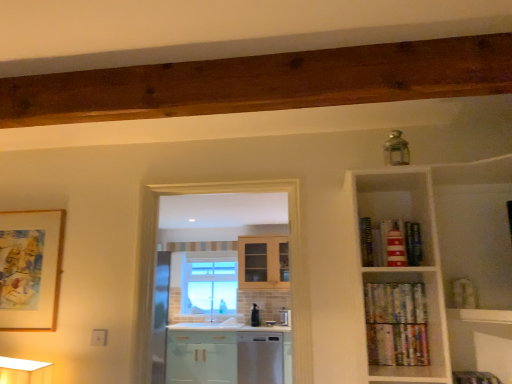
You are a GUI agent. You are given a task and a screenshot of the screen. Output one action in this format:
    pyautogui.click(x=<x>, y=<y>)
    Task: Click on the clear glass window at center
    The height and width of the screenshot is (384, 512).
    Given the screenshot: What is the action you would take?
    pyautogui.click(x=209, y=283)

The height and width of the screenshot is (384, 512). What do you see at coordinates (395, 303) in the screenshot?
I see `hardcover books at right, the second book positioned from the top` at bounding box center [395, 303].

What do you see at coordinates (30, 269) in the screenshot?
I see `wooden picture frame at left` at bounding box center [30, 269].

Where is `multicolored paperbacks at lower right, marked as the 3th book in a top-to-bottom arrangement`? The height and width of the screenshot is (384, 512). multicolored paperbacks at lower right, marked as the 3th book in a top-to-bottom arrangement is located at coordinates (397, 344).

What do you see at coordinates (397, 344) in the screenshot? The width and height of the screenshot is (512, 384). I see `multicolored paperbacks at lower right, marked as the 3th book in a top-to-bottom arrangement` at bounding box center [397, 344].

What are the coordinates of `metallic stainless steel kettle at center` in the screenshot? It's located at (255, 315).

Considering the relative sizes of multicolored paperbacks at lower right, marked as the 3th book in a top-to-bottom arrangement, and hardcover books at right, the second book positioned from the top, in the image provided, is multicolored paperbacks at lower right, marked as the 3th book in a top-to-bottom arrangement, shorter than hardcover books at right, the second book positioned from the top,?

No.

Does multicolored paperbacks at lower right, marked as the 3th book in a top-to-bottom arrangement, appear on the left side of hardcover books at right, the second book positioned from the top?

In fact, multicolored paperbacks at lower right, marked as the 3th book in a top-to-bottom arrangement, is to the right of hardcover books at right, the second book positioned from the top.

From the picture: Does multicolored paperbacks at lower right, the first book from the bottom, have a greater width compared to hardcover books at right, positioned as the 2th book in bottom-to-top order?

Incorrect, the width of multicolored paperbacks at lower right, the first book from the bottom, does not surpass that of hardcover books at right, positioned as the 2th book in bottom-to-top order.

Can you confirm if multicolored paperbacks at lower right, marked as the 3th book in a top-to-bottom arrangement, is smaller than hardcover books at right, positioned as the 2th book in bottom-to-top order?

Indeed, multicolored paperbacks at lower right, marked as the 3th book in a top-to-bottom arrangement, has a smaller size compared to hardcover books at right, positioned as the 2th book in bottom-to-top order.

Which object is wider, wooden picture frame at left or satin white dishwasher at center?

satin white dishwasher at center is wider.

Which is in front, point (33, 245) or point (246, 381)?

The point (33, 245) is more forward.

Is wooden picture frame at left positioned far away from satin white dishwasher at center?

That's right, there is a large distance between wooden picture frame at left and satin white dishwasher at center.

In the scene shown: Can you confirm if wooden picture frame at left is smaller than satin white dishwasher at center?

Yes.

Is point (368, 350) positioned in front of point (252, 316)?

Yes, it is.

Is multicolored paperbacks at lower right, the first book from the bottom, positioned far away from metallic stainless steel kettle at center?

Absolutely, multicolored paperbacks at lower right, the first book from the bottom, is distant from metallic stainless steel kettle at center.

Looking at this image, considering the sizes of objects multicolored paperbacks at lower right, the first book from the bottom, and metallic stainless steel kettle at center in the image provided, who is shorter, multicolored paperbacks at lower right, the first book from the bottom, or metallic stainless steel kettle at center?

multicolored paperbacks at lower right, the first book from the bottom.

Considering the relative positions of multicolored paperbacks at lower right, marked as the 3th book in a top-to-bottom arrangement, and metallic stainless steel kettle at center in the image provided, is multicolored paperbacks at lower right, marked as the 3th book in a top-to-bottom arrangement, in front of metallic stainless steel kettle at center?

That is True.

Looking at the image, does metallic stainless steel kettle at center seem bigger or smaller compared to red striped lighthouse at upper right, placed as the 1th book when sorted from top to bottom?

metallic stainless steel kettle at center is smaller than red striped lighthouse at upper right, placed as the 1th book when sorted from top to bottom.

Is metallic stainless steel kettle at center facing towards red striped lighthouse at upper right, which appears as the third book when ordered from the bottom?

No.

Which is more to the left, metallic stainless steel kettle at center or red striped lighthouse at upper right, which appears as the third book when ordered from the bottom?

Positioned to the left is metallic stainless steel kettle at center.

From a real-world perspective, between satin white dishwasher at center and metallic stainless steel kettle at center, who is vertically lower?

satin white dishwasher at center is physically lower.

Are satin white dishwasher at center and metallic stainless steel kettle at center making contact?

satin white dishwasher at center is not next to metallic stainless steel kettle at center, and they're not touching.

From the image's perspective, is satin white dishwasher at center located beneath metallic stainless steel kettle at center?

Yes, from the image's perspective, satin white dishwasher at center is beneath metallic stainless steel kettle at center.

Considering the positions of point (237, 365) and point (251, 321), is point (237, 365) closer or farther from the camera than point (251, 321)?

Clearly, point (237, 365) is closer to the camera than point (251, 321).

From a real-world perspective, is clear glass window at center above or below wooden picture frame at left?

clear glass window at center is below wooden picture frame at left.

Would you consider clear glass window at center to be distant from wooden picture frame at left?

Indeed, clear glass window at center is not near wooden picture frame at left.

From the image's perspective, is clear glass window at center located above or below wooden picture frame at left?

Based on their image positions, clear glass window at center is located beneath wooden picture frame at left.

The image size is (512, 384). Identify the location of window below the wooden picture frame at left (from a real-world perspective). (209, 283).

Consider the image. Based on their sizes in the image, would you say clear glass window at center is bigger or smaller than multicolored paperbacks at lower right, marked as the 3th book in a top-to-bottom arrangement?

Considering their sizes, clear glass window at center takes up more space than multicolored paperbacks at lower right, marked as the 3th book in a top-to-bottom arrangement.

Considering the sizes of clear glass window at center and multicolored paperbacks at lower right, marked as the 3th book in a top-to-bottom arrangement, in the image, is clear glass window at center wider or thinner than multicolored paperbacks at lower right, marked as the 3th book in a top-to-bottom arrangement,?

Considering their sizes, clear glass window at center looks broader than multicolored paperbacks at lower right, marked as the 3th book in a top-to-bottom arrangement.

Is clear glass window at center shorter than multicolored paperbacks at lower right, the first book from the bottom?

No, clear glass window at center is not shorter than multicolored paperbacks at lower right, the first book from the bottom.

Does clear glass window at center come behind multicolored paperbacks at lower right, the first book from the bottom?

Yes, the depth of clear glass window at center is greater than that of multicolored paperbacks at lower right, the first book from the bottom.

There is a multicolored paperbacks at lower right, the first book from the bottom. At what (x,y) coordinates should I click in order to perform the action: click on the 1st book above it (from the image's perspective). Please return your answer as a coordinate pair (x, y). Looking at the image, I should click on (395, 303).

You are a GUI agent. You are given a task and a screenshot of the screen. Output one action in this format:
    pyautogui.click(x=<x>, y=<y>)
    Task: Click on the dish washer on the right of wooden picture frame at left
    
    Given the screenshot: What is the action you would take?
    pyautogui.click(x=260, y=358)

Considering their positions, is red striped lighthouse at upper right, placed as the 1th book when sorted from top to bottom, positioned closer to satin white dishwasher at center than clear glass window at center?

clear glass window at center.

Considering their positions, is metallic stainless steel kettle at center positioned further to clear glass window at center than hardcover books at right, the second book positioned from the top?

hardcover books at right, the second book positioned from the top, is positioned further to the anchor clear glass window at center.

Based on their spatial positions, is metallic stainless steel kettle at center or red striped lighthouse at upper right, placed as the 1th book when sorted from top to bottom, closer to multicolored paperbacks at lower right, marked as the 3th book in a top-to-bottom arrangement?

red striped lighthouse at upper right, placed as the 1th book when sorted from top to bottom, lies closer to multicolored paperbacks at lower right, marked as the 3th book in a top-to-bottom arrangement, than the other object.

Based on the photo, estimate the real-world distances between objects in this image. Which object is further from hardcover books at right, positioned as the 2th book in bottom-to-top order, clear glass window at center or wooden picture frame at left?

clear glass window at center is further to hardcover books at right, positioned as the 2th book in bottom-to-top order.

From the image, which object appears to be farther from red striped lighthouse at upper right, placed as the 1th book when sorted from top to bottom, metallic stainless steel kettle at center or clear glass window at center?

Based on the image, clear glass window at center appears to be further to red striped lighthouse at upper right, placed as the 1th book when sorted from top to bottom.

From the picture: Based on their spatial positions, is red striped lighthouse at upper right, which appears as the third book when ordered from the bottom, or metallic stainless steel kettle at center closer to hardcover books at right, the second book positioned from the top?

red striped lighthouse at upper right, which appears as the third book when ordered from the bottom.

Based on their spatial positions, is multicolored paperbacks at lower right, the first book from the bottom, or wooden picture frame at left further from satin white dishwasher at center?

multicolored paperbacks at lower right, the first book from the bottom.

Looking at the image, which one is located closer to satin white dishwasher at center, hardcover books at right, positioned as the 2th book in bottom-to-top order, or red striped lighthouse at upper right, placed as the 1th book when sorted from top to bottom?

Based on the image, hardcover books at right, positioned as the 2th book in bottom-to-top order, appears to be nearer to satin white dishwasher at center.

Locate an element on the screen. This screenshot has height=384, width=512. dish washer between hardcover books at right, the second book positioned from the top, and clear glass window at center in the front-back direction is located at coordinates (260, 358).

I want to click on dish washer positioned between red striped lighthouse at upper right, placed as the 1th book when sorted from top to bottom, and clear glass window at center from near to far, so click(x=260, y=358).

The width and height of the screenshot is (512, 384). In order to click on book between multicolored paperbacks at lower right, the first book from the bottom, and clear glass window at center in the front-back direction in this screenshot , I will do `click(395, 303)`.

This screenshot has width=512, height=384. In order to click on appliance positioned between satin white dishwasher at center and clear glass window at center from near to far in this screenshot , I will do `click(255, 315)`.